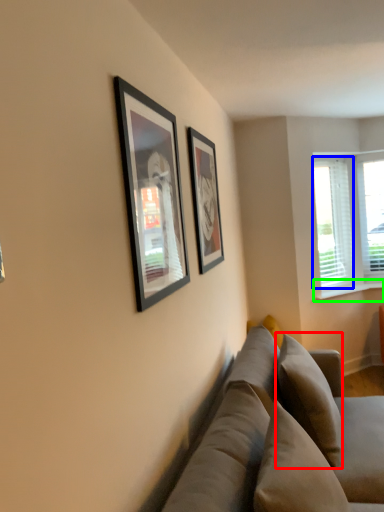
Question: Based on their relative distances, which object is farther from pillow (highlighted by a red box)? Choose from window screen (highlighted by a blue box) and window sill (highlighted by a green box).

Choices:
 (A) window screen
 (B) window sill

Answer: (A)